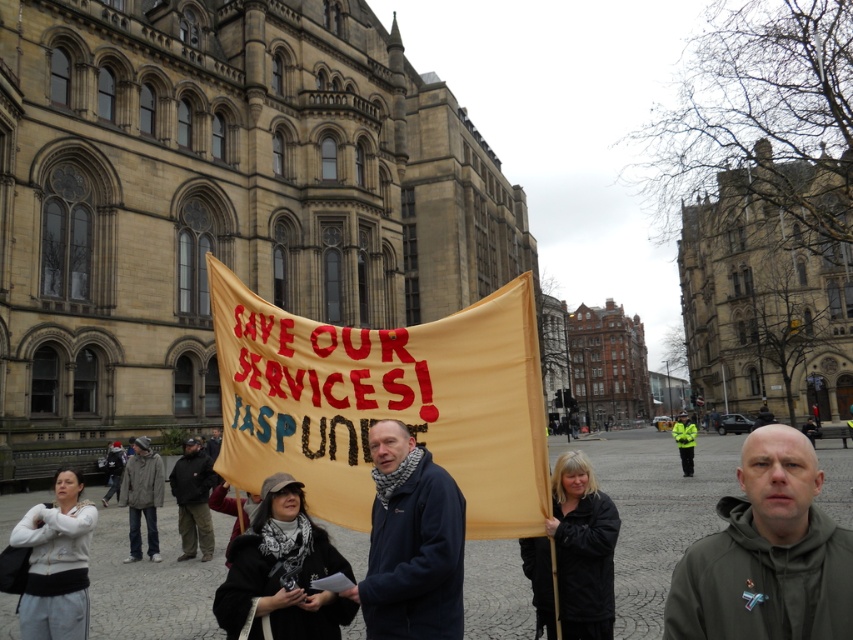
You are a photographer trying to capture a clear shot of the protest banner. You notice two jackets in the foreground, a dark blue jacket at center and a dark brown leather jacket at center. Which jacket should you focus on to ensure the banner remains in the background?

The dark blue jacket at center is thinner than the dark brown leather jacket at center, so focusing on the dark blue jacket at center would allow the banner to stay in the background more clearly.

Looking at this image, you are a photographer trying to capture a clear shot of the banner. You notice two people in the foreground wearing a dark green hoodie at center and a dark brown leather jacket at center. Which clothing item is closer to the camera?

The dark green hoodie at center is below the dark brown leather jacket at center, meaning it is closer to the camera.

You are a photographer standing in front of the historic Gothic building. You want to capture a photo of the dark green hoodie at center without including the building in the background. Is the distance sufficient to achieve this?

The dark green hoodie at center is 23.73 meters from the viewer. Since the distance is quite far, it might be challenging to exclude the large historic building in the background unless using a telephoto lens to compress the scene. However, the exact feasibility depends on the camera equipment and framing.